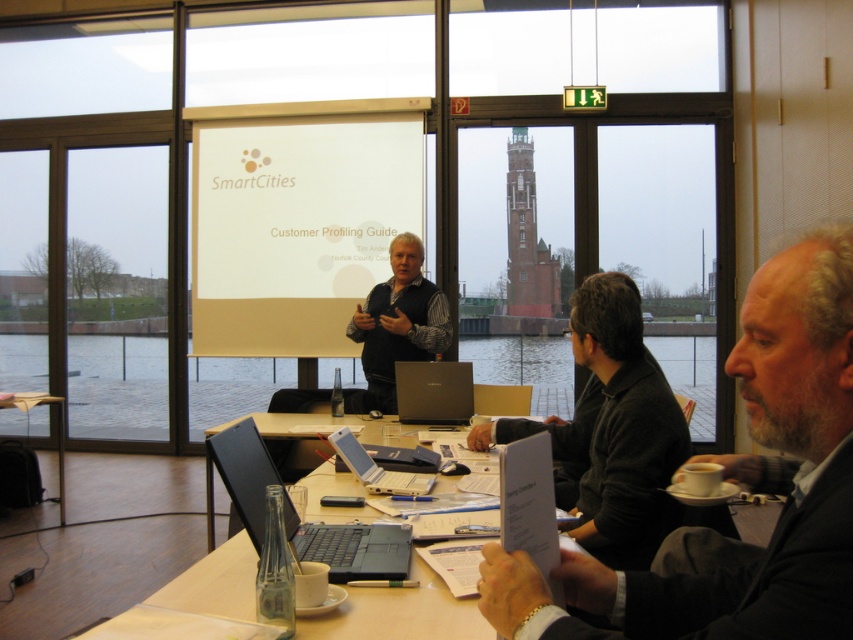
Question: Which point is farther to the camera?

Choices:
 (A) (403, 420)
 (B) (692, 579)
 (C) (376, 486)

Answer: (A)

Question: Among these points, which one is farthest from the camera?

Choices:
 (A) pos(251,467)
 (B) pos(398,129)
 (C) pos(370,355)
 (D) pos(195,624)

Answer: (B)

Question: Does white matte projector screen at center appear under matte black shirt at center?

Choices:
 (A) yes
 (B) no

Answer: (B)

Question: Can you confirm if matte black laptop at center is positioned to the left of satin black laptop at center?

Choices:
 (A) yes
 (B) no

Answer: (A)

Question: Which point is farther to the camera?

Choices:
 (A) dark gray sweater at center
 (B) satin black laptop at center

Answer: (B)

Question: Does dark gray sweater at center appear under black matte laptop at center?

Choices:
 (A) yes
 (B) no

Answer: (B)